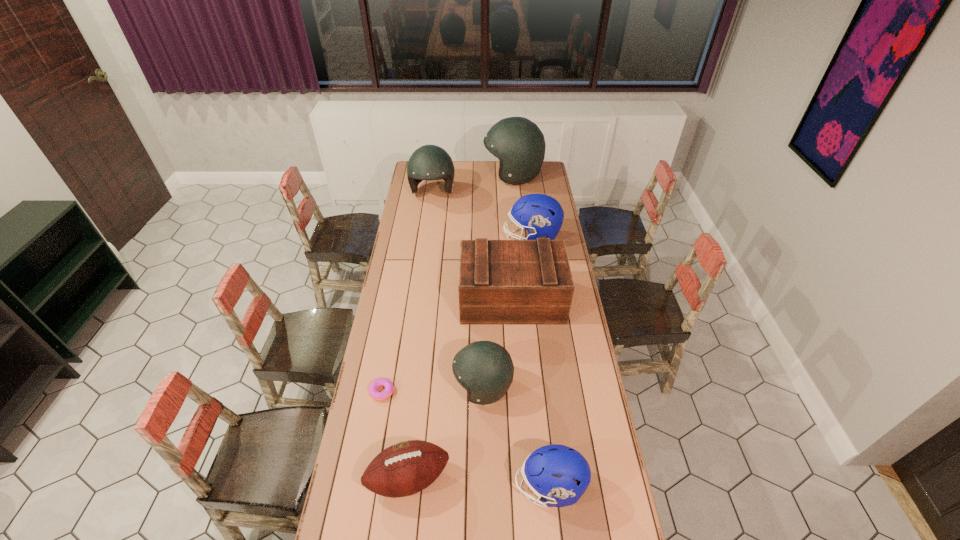
You are a GUI agent. You are given a task and a screenshot of the screen. Output one action in this format:
    pyautogui.click(x=<x>, y=<y>)
    Task: Click on the free space that is in between the second smallest green football helmet and the smaller blue football helmet
    The height and width of the screenshot is (540, 960).
    Given the screenshot: What is the action you would take?
    pyautogui.click(x=491, y=340)

Where is `unoccupied position between the smaller blue football helmet and the fourth farthest football helmet`? unoccupied position between the smaller blue football helmet and the fourth farthest football helmet is located at coordinates (516, 436).

At what (x,y) coordinates should I click in order to perform the action: click on vacant area that lies between the farther blue football helmet and the doughnut. Please return your answer as a coordinate pair (x, y). Looking at the image, I should click on (457, 315).

You are a GUI agent. You are given a task and a screenshot of the screen. Output one action in this format:
    pyautogui.click(x=<x>, y=<y>)
    Task: Click on the vacant space in between the tallest object and the doughnut
    
    Given the screenshot: What is the action you would take?
    pyautogui.click(x=447, y=283)

Where is `free spot between the brown football (American) and the nearest green football helmet`? The image size is (960, 540). free spot between the brown football (American) and the nearest green football helmet is located at coordinates (x=445, y=433).

I want to click on blank region between the sixth nearest object and the shortest object, so click(x=457, y=315).

Where is `vacant point located between the seventh tallest object and the tallest object`? Image resolution: width=960 pixels, height=540 pixels. vacant point located between the seventh tallest object and the tallest object is located at coordinates (461, 327).

This screenshot has width=960, height=540. I want to click on object identified as the sixth closest to the third nearest football helmet, so click(x=406, y=468).

This screenshot has width=960, height=540. In order to click on the closest object to the smaller blue football helmet in this screenshot , I will do `click(485, 369)`.

Select which football helmet appears as the third closest to the smallest green football helmet. Please provide its 2D coordinates. Your answer should be formatted as a tuple, i.e. [(x, y)], where the tuple contains the x and y coordinates of a point satisfying the conditions above.

[(429, 162)]